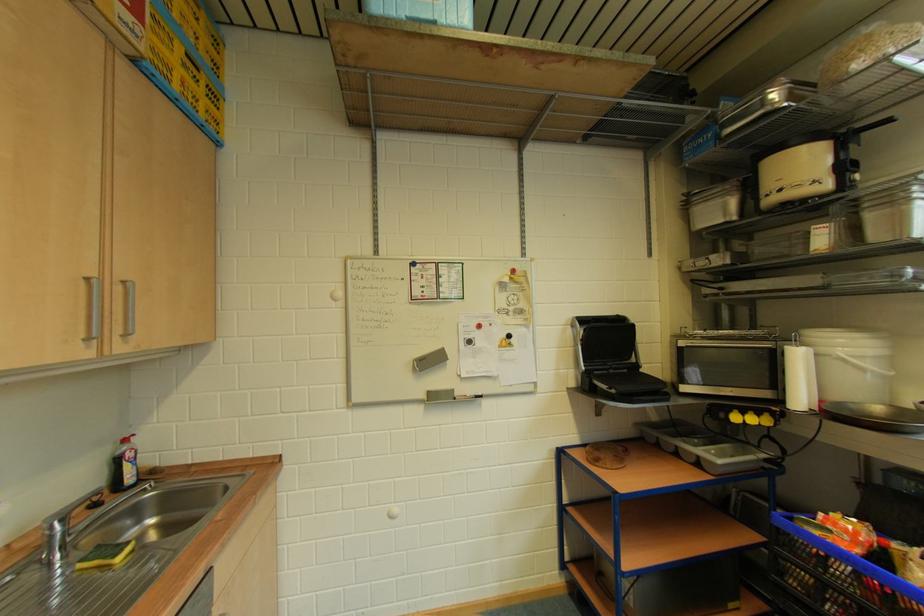
Identify the location of red pump dispenser. (123, 469).